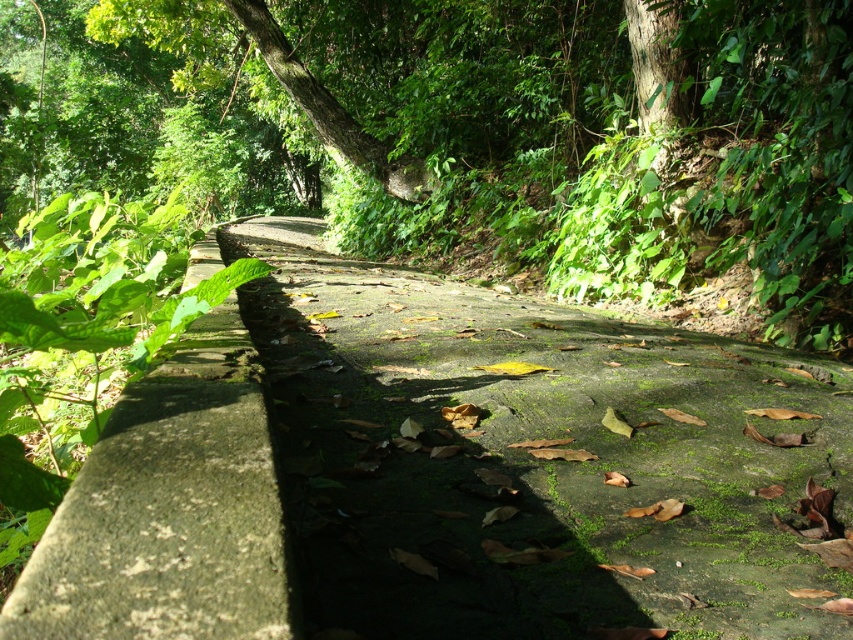
Question: Which point is closer to the camera taking this photo?

Choices:
 (A) (213, 573)
 (B) (270, 372)

Answer: (A)

Question: Which of the following is the closest to the observer?

Choices:
 (A) green mossy stone at left
 (B) green mossy concrete trail at center

Answer: (A)

Question: Can you confirm if green mossy concrete trail at center is thinner than green mossy stone at left?

Choices:
 (A) yes
 (B) no

Answer: (B)

Question: Can you confirm if green mossy concrete trail at center is wider than green mossy stone at left?

Choices:
 (A) yes
 (B) no

Answer: (A)

Question: Observing the image, what is the correct spatial positioning of green mossy concrete trail at center in reference to green mossy stone at left?

Choices:
 (A) below
 (B) above

Answer: (A)

Question: Which object appears closest to the camera in this image?

Choices:
 (A) green mossy concrete trail at center
 (B) green mossy stone at left

Answer: (B)